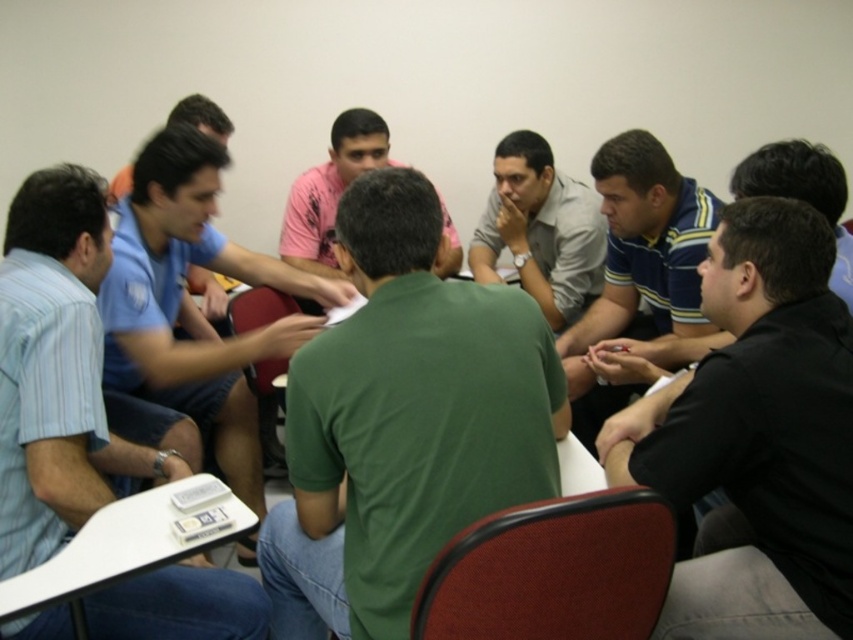
Can you confirm if light blue shirt at left is bigger than pink textured shirt at center?

Yes, light blue shirt at left is bigger than pink textured shirt at center.

Is light blue shirt at left behind pink textured shirt at center?

No.

Between point (22, 330) and point (300, 244), which one is positioned behind?

The point (300, 244) is behind.

I want to click on light blue shirt at left, so click(56, 369).

Find the location of a particular element. light blue shirt at left is located at coordinates (56, 369).

The image size is (853, 640). I want to click on light blue shirt at left, so click(x=56, y=369).

Is green matte shirt at center thinner than blue shirt at center?

In fact, green matte shirt at center might be wider than blue shirt at center.

Which is behind, point (463, 368) or point (161, 236)?

Positioned behind is point (161, 236).

Who is more forward, (433,497) or (181,138)?

Positioned in front is point (433,497).

Where is `green matte shirt at center`? This screenshot has height=640, width=853. green matte shirt at center is located at coordinates click(403, 420).